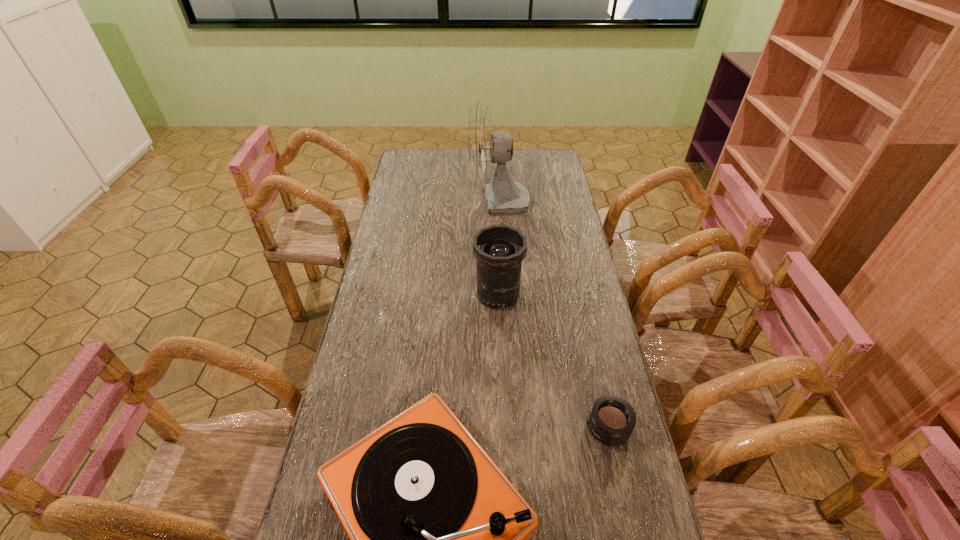
Locate an element on the screen. The height and width of the screenshot is (540, 960). free spot located on the side of the nearer telephoto lens with brand markings and control switches is located at coordinates (478, 428).

Identify the location of blank area located 0.050m on the side of the nearer telephoto lens with brand markings and control switches. The image size is (960, 540). (566, 428).

Identify the location of blank space located on the side of the nearer telephoto lens with brand markings and control switches. This screenshot has width=960, height=540. (559, 428).

The width and height of the screenshot is (960, 540). Identify the location of object that is at the right edge. (611, 421).

Locate an element on the screen. The width and height of the screenshot is (960, 540). vacant space at the left edge is located at coordinates (407, 299).

Identify the location of vacant area at the right edge. This screenshot has height=540, width=960. (635, 467).

I want to click on vacant area at the far left corner of the desktop, so click(427, 161).

This screenshot has width=960, height=540. I want to click on vacant space in between the fan and the shortest object, so click(553, 315).

You are a GUI agent. You are given a task and a screenshot of the screen. Output one action in this format:
    pyautogui.click(x=<x>, y=<y>)
    Task: Click on the vacant area that lies between the right telephoto lens and the third nearest object
    
    Given the screenshot: What is the action you would take?
    pyautogui.click(x=553, y=362)

In order to click on vacant area between the tallest object and the rightmost object in this screenshot , I will do `click(553, 315)`.